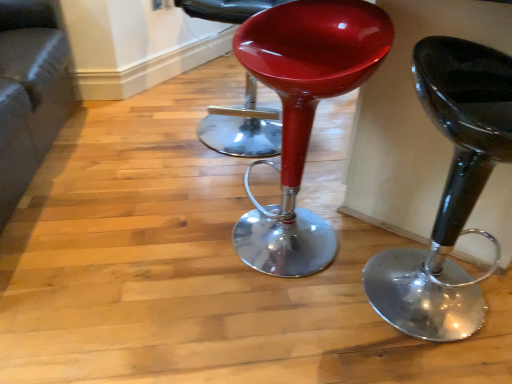
Identify the location of blank space to the left of glossy plastic stool at center, the 1th stool in the right-to-left sequence. This screenshot has height=384, width=512. (294, 327).